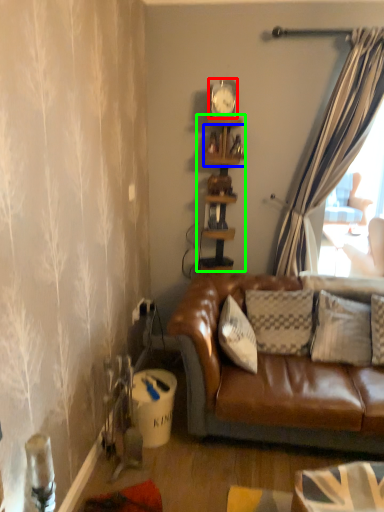
Question: Estimate the real-world distances between objects in this image. Which object is farther from clock (highlighted by a red box), shelf (highlighted by a blue box) or shelf (highlighted by a green box)?

Choices:
 (A) shelf
 (B) shelf

Answer: (B)